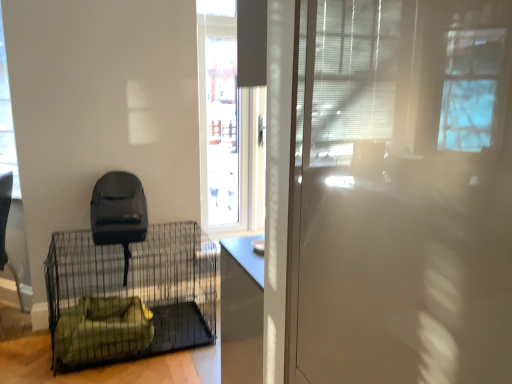
Question: From the image's perspective, would you say transparent glass window at upper left is shown under green fabric pet bed at lower left?

Choices:
 (A) yes
 (B) no

Answer: (B)

Question: Is transparent glass window at upper left thinner than green fabric pet bed at lower left?

Choices:
 (A) yes
 (B) no

Answer: (A)

Question: From a real-world perspective, is transparent glass window at upper left under green fabric pet bed at lower left?

Choices:
 (A) yes
 (B) no

Answer: (B)

Question: Is transparent glass window at upper left closer to camera compared to green fabric pet bed at lower left?

Choices:
 (A) no
 (B) yes

Answer: (A)

Question: Can you confirm if transparent glass window at upper left is wider than green fabric pet bed at lower left?

Choices:
 (A) yes
 (B) no

Answer: (B)

Question: Can you confirm if transparent glass window at upper left is positioned to the right of green fabric pet bed at lower left?

Choices:
 (A) no
 (B) yes

Answer: (A)

Question: Considering the relative sizes of green fabric pet bed at lower left and transparent glass window at upper left in the image provided, is green fabric pet bed at lower left shorter than transparent glass window at upper left?

Choices:
 (A) no
 (B) yes

Answer: (B)

Question: Is green fabric pet bed at lower left at the right side of transparent glass window at upper left?

Choices:
 (A) no
 (B) yes

Answer: (B)

Question: Is green fabric pet bed at lower left looking in the opposite direction of transparent glass window at upper left?

Choices:
 (A) yes
 (B) no

Answer: (B)

Question: Is green fabric pet bed at lower left positioned far away from transparent glass window at upper left?

Choices:
 (A) no
 (B) yes

Answer: (A)

Question: From the image's perspective, would you say green fabric pet bed at lower left is shown under transparent glass window at upper left?

Choices:
 (A) yes
 (B) no

Answer: (A)

Question: Can we say green fabric pet bed at lower left lies outside transparent glass window at upper left?

Choices:
 (A) yes
 (B) no

Answer: (A)

Question: From a real-world perspective, relative to transparent glass window at upper left, is green fabric pet bed at lower left vertically above or below?

Choices:
 (A) below
 (B) above

Answer: (A)